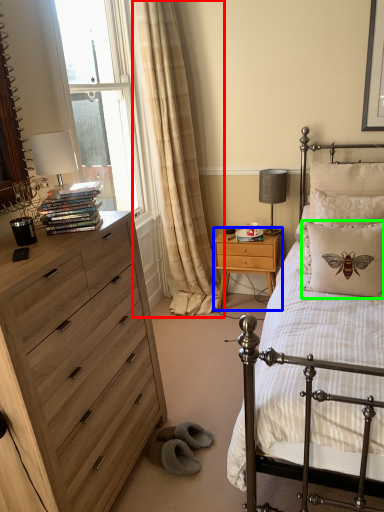
Question: Which object is positioned farthest from curtain (highlighted by a red box)? Select from nightstand (highlighted by a blue box) and pillow (highlighted by a green box).

Choices:
 (A) nightstand
 (B) pillow

Answer: (B)